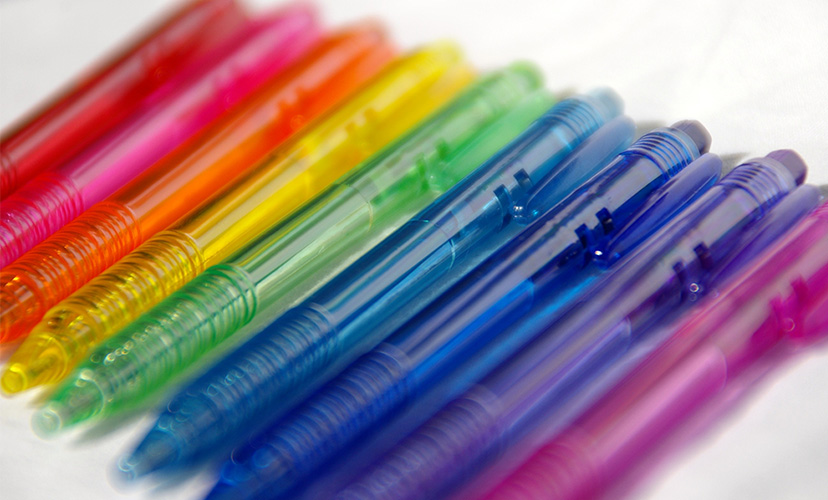
The height and width of the screenshot is (500, 828). What are the coordinates of `pens` in the screenshot? It's located at (80, 114), (116, 161), (155, 195), (203, 222), (261, 268), (339, 323), (407, 353), (499, 387), (591, 419).